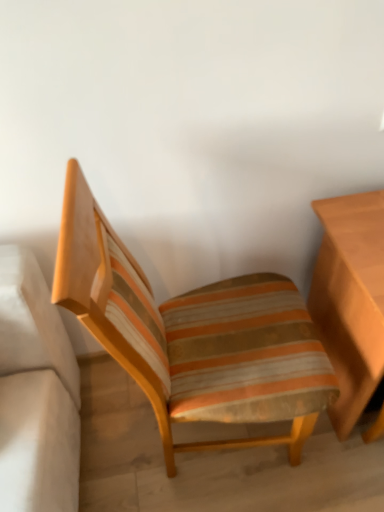
Question: Based on their sizes in the image, would you say light brown wooden table at right is bigger or smaller than striped fabric chair at center?

Choices:
 (A) small
 (B) big

Answer: (A)

Question: Is light brown wooden table at right taller or shorter than striped fabric chair at center?

Choices:
 (A) short
 (B) tall

Answer: (A)

Question: In terms of width, does light brown wooden table at right look wider or thinner when compared to striped fabric chair at center?

Choices:
 (A) wide
 (B) thin

Answer: (B)

Question: From their relative heights in the image, would you say striped fabric chair at center is taller or shorter than light brown wooden table at right?

Choices:
 (A) tall
 (B) short

Answer: (A)

Question: Based on their sizes in the image, would you say striped fabric chair at center is bigger or smaller than light brown wooden table at right?

Choices:
 (A) big
 (B) small

Answer: (A)

Question: Is striped fabric chair at center inside or outside of light brown wooden table at right?

Choices:
 (A) inside
 (B) outside

Answer: (B)

Question: Is point (216, 382) positioned closer to the camera than point (327, 279)?

Choices:
 (A) closer
 (B) farther

Answer: (A)